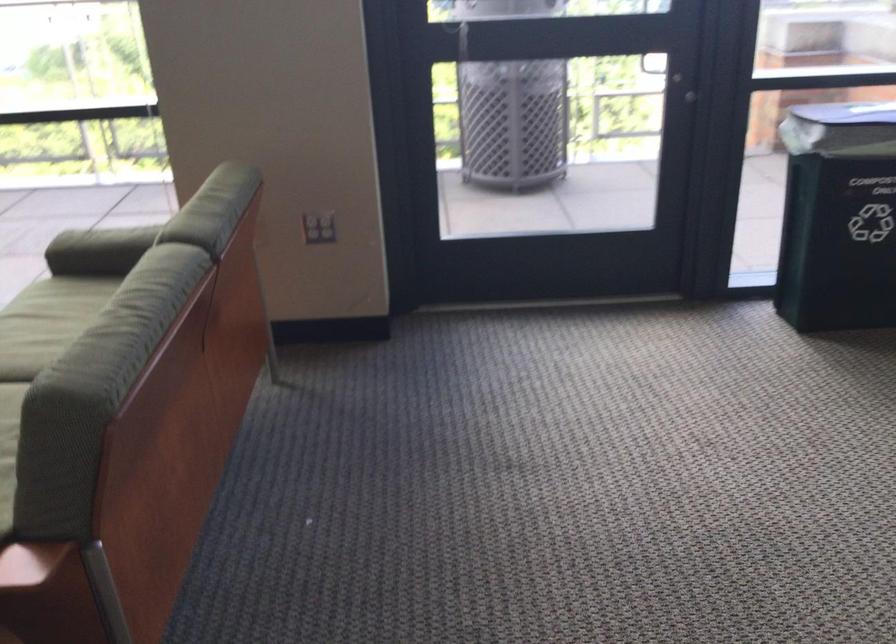
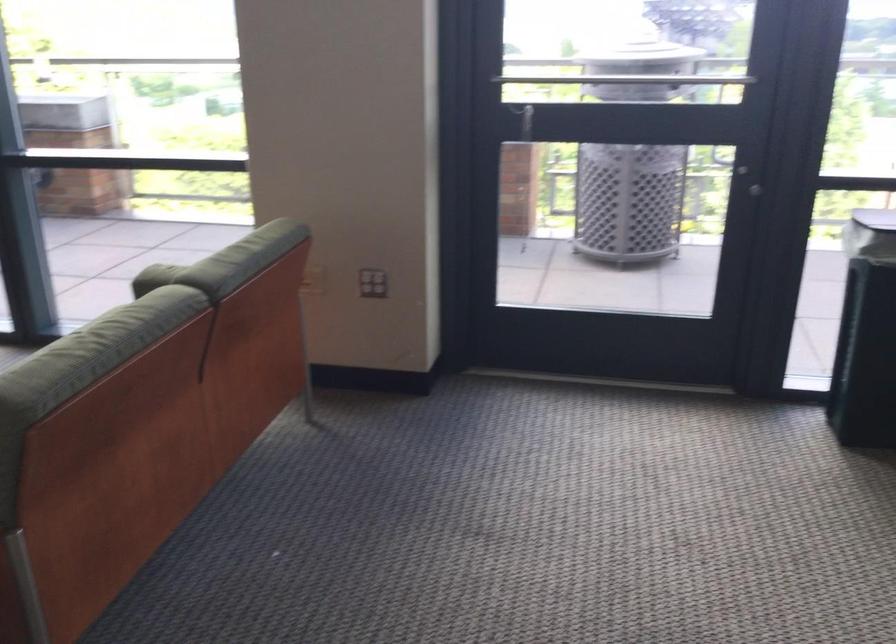
Question: What movement of the cameraman would produce the second image?

Choices:
 (A) Left
 (B) Right
 (C) Forward
 (D) Backward

Answer: (B)